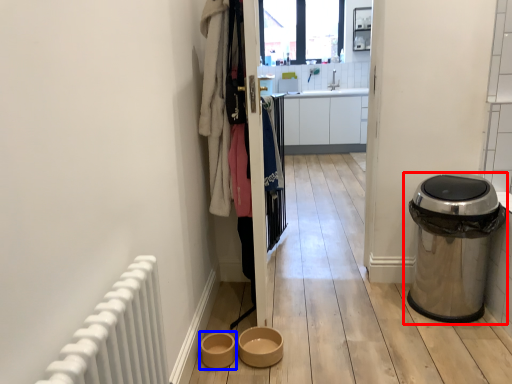
Question: Which object is closer to the camera taking this photo, waste container (highlighted by a red box) or toilet bowl (highlighted by a blue box)?

Choices:
 (A) waste container
 (B) toilet bowl

Answer: (A)